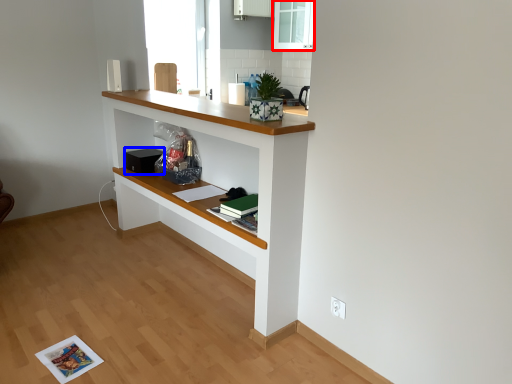
Question: Among these objects, which one is farthest to the camera, glass door (highlighted by a red box) or appliance (highlighted by a blue box)?

Choices:
 (A) glass door
 (B) appliance

Answer: (A)